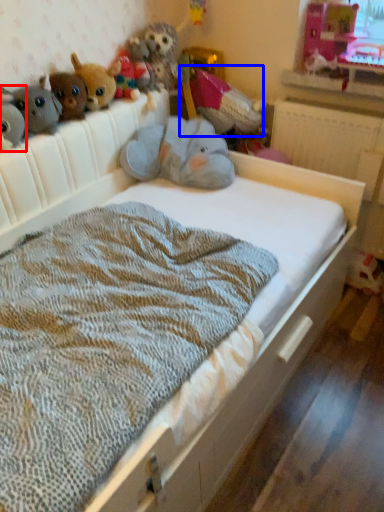
Question: Which of the following is the farthest to the observer, toy (highlighted by a red box) or toy (highlighted by a blue box)?

Choices:
 (A) toy
 (B) toy

Answer: (B)